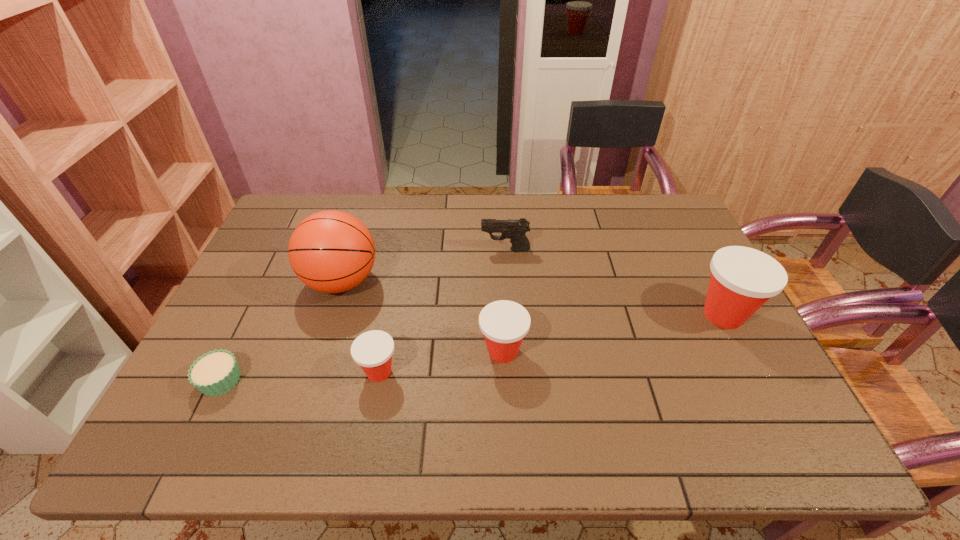
Locate an element on the screen. the shortest Dixie cup is located at coordinates (372, 350).

What are the coordinates of `the second shortest object` in the screenshot? It's located at (372, 350).

At what (x,y) coordinates should I click in order to perform the action: click on the second Dixie cup from left to right. Please return your answer as a coordinate pair (x, y). The image size is (960, 540). Looking at the image, I should click on (504, 323).

The width and height of the screenshot is (960, 540). What are the coordinates of `the rightmost object` in the screenshot? It's located at (742, 279).

This screenshot has width=960, height=540. I want to click on the rightmost Dixie cup, so click(742, 279).

In order to click on pistol in this screenshot , I will do `click(514, 229)`.

The width and height of the screenshot is (960, 540). Find the location of `basketball`. basketball is located at coordinates (331, 251).

This screenshot has width=960, height=540. Find the location of `the leftmost object`. the leftmost object is located at coordinates (215, 373).

This screenshot has width=960, height=540. I want to click on the shortest object, so click(x=215, y=373).

The image size is (960, 540). I want to click on free point located on the back of the shortest Dixie cup, so click(x=394, y=295).